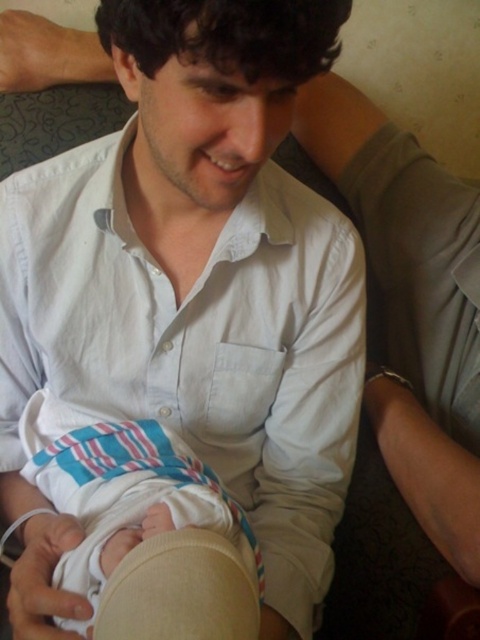
You are a photographer trying to capture a candid shot of the man and baby in the scene. To ensure the white cotton shirt at center and striped cotton diaper at center are both clearly visible in the frame, which object should you position closer to the left side of the camera viewfinder?

You should position the striped cotton diaper at center closer to the left side of the camera viewfinder because the white cotton shirt at center is to the right of the striped cotton diaper at center.

In the scene shown: You are a photographer trying to capture a candid shot of the man and baby in the scene. You want to focus on the area where the point at coordinates (199, 342) is located. What object is at this point?

The point at coordinates (199, 342) is on the white cotton shirt at center.

You are a photographer trying to capture a closeup of the white cotton shirt at center and the striped cotton diaper at center. Since you want to focus on both items clearly, which one should you adjust your camera focus to prioritize based on their sizes?

The white cotton shirt at center is larger in size than the striped cotton diaper at center, so you should prioritize focusing on the white cotton shirt at center to ensure both are in clear view.